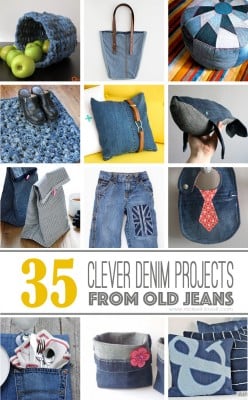
Find the location of a particular element. Image resolution: width=248 pixels, height=400 pixels. pillow is located at coordinates (210, 359), (236, 355), (230, 325), (116, 123).